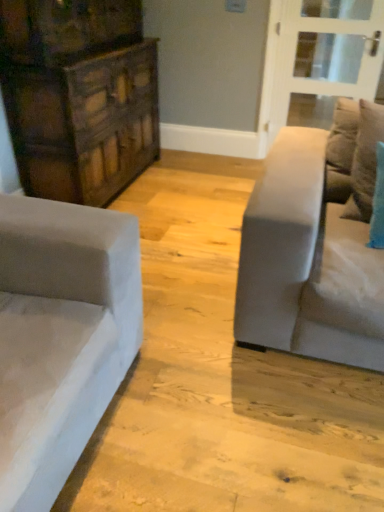
Question: Is point (258, 313) positioned closer to the camera than point (157, 119)?

Choices:
 (A) closer
 (B) farther

Answer: (A)

Question: From a real-world perspective, is light gray fabric couch at right positioned above or below dark wood dresser at left?

Choices:
 (A) above
 (B) below

Answer: (B)

Question: Estimate the real-world distances between objects in this image. Which object is farther from the velvet teal pillow at right?

Choices:
 (A) light gray fabric couch at right
 (B) clear glass door at upper right
 (C) dark wood dresser at left

Answer: (C)

Question: Estimate the real-world distances between objects in this image. Which object is farther from the velvet teal pillow at right?

Choices:
 (A) clear glass door at upper right
 (B) dark wood dresser at left
 (C) light gray fabric couch at right

Answer: (B)